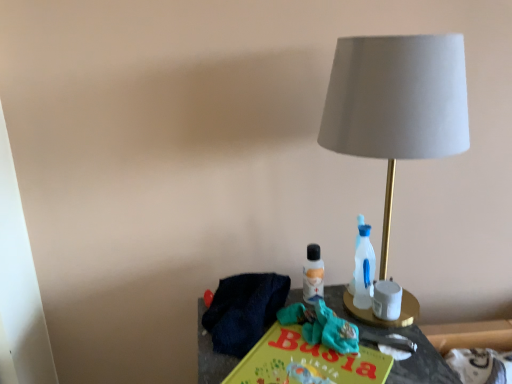
I want to click on free space behind teal fabric scrub at center, so pyautogui.click(x=304, y=286).